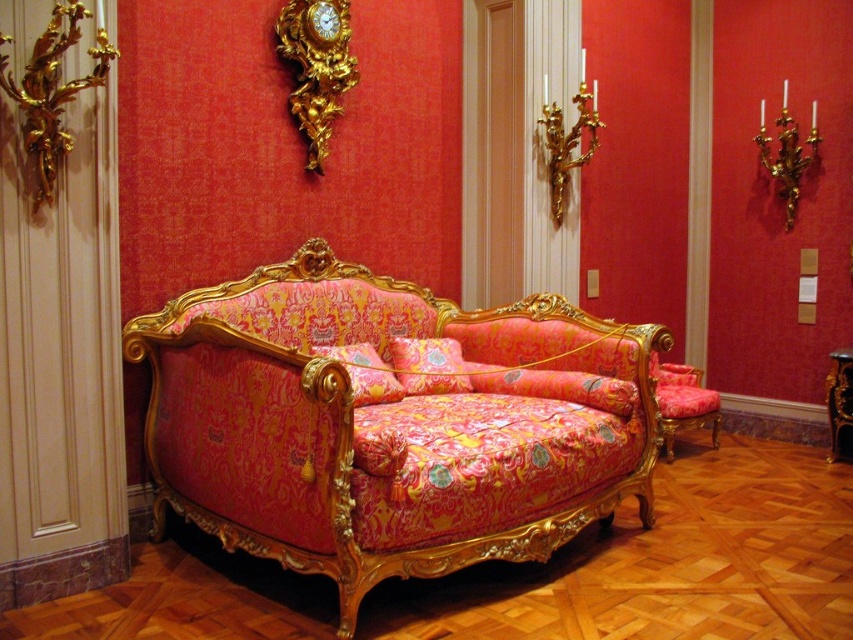
Does point (264, 356) come closer to viewer compared to point (315, 81)?

Yes.

Is point (361, 572) farther from viewer compared to point (347, 61)?

No, it is in front of (347, 61).

Is point (230, 502) positioned before point (343, 0)?

Yes, it is.

Find the location of a particular element. This screenshot has width=853, height=640. matte pink fabric couch at center is located at coordinates (390, 422).

In the scene shown: Can you confirm if matte pink fabric couch at center is smaller than velvet floral armchair at center?

Actually, matte pink fabric couch at center might be larger than velvet floral armchair at center.

Measure the distance from matte pink fabric couch at center to velvet floral armchair at center.

5.80 feet

Between point (405, 448) and point (662, 374), which one is positioned behind?

Point (662, 374)

The image size is (853, 640). What are the coordinates of `matte pink fabric couch at center` in the screenshot? It's located at (390, 422).

This screenshot has width=853, height=640. What do you see at coordinates (316, 67) in the screenshot?
I see `gold ornate clock at upper center` at bounding box center [316, 67].

Is point (332, 42) closer to camera compared to point (677, 378)?

Yes, point (332, 42) is in front of point (677, 378).

Is point (338, 36) positioned behind point (701, 406)?

That is False.

This screenshot has height=640, width=853. In order to click on gold ornate clock at upper center in this screenshot , I will do `click(316, 67)`.